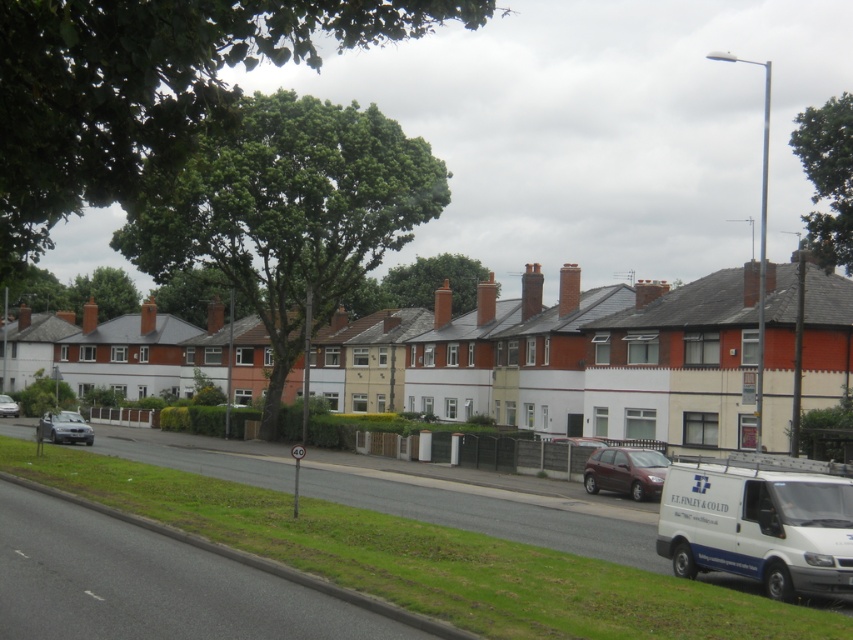
You are a delivery driver who needs to park your white matte van at lower right exactly at the point marked by coordinates (758, 525). Can you confirm if this point is located on the right side of the road?

The white matte van at lower right is represented by point (758, 525), so yes, the point is on the right side of the road where the van is parked.

You are a pedestrian standing at the point closer to the viewer between point (x=709, y=481) and point (x=1, y=394). You want to walk to the white van parked on the right side of the image. Which point should you head towards?

You should head towards point (x=1, y=394) because it is farther away from you than point (x=709, y=481), so walking towards it will take you closer to the white van on the right side.

You are standing at the point labeled as point (x=430, y=545) in the image. What is the color of the ground beneath your feet?

The point (x=430, y=545) indicates green grass at lower left, so the ground beneath your feet is green grass.